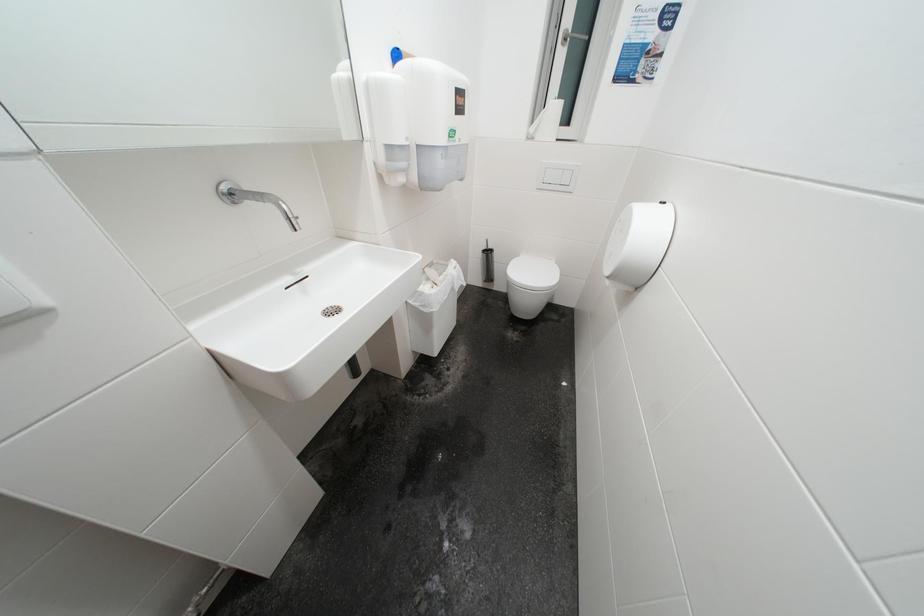
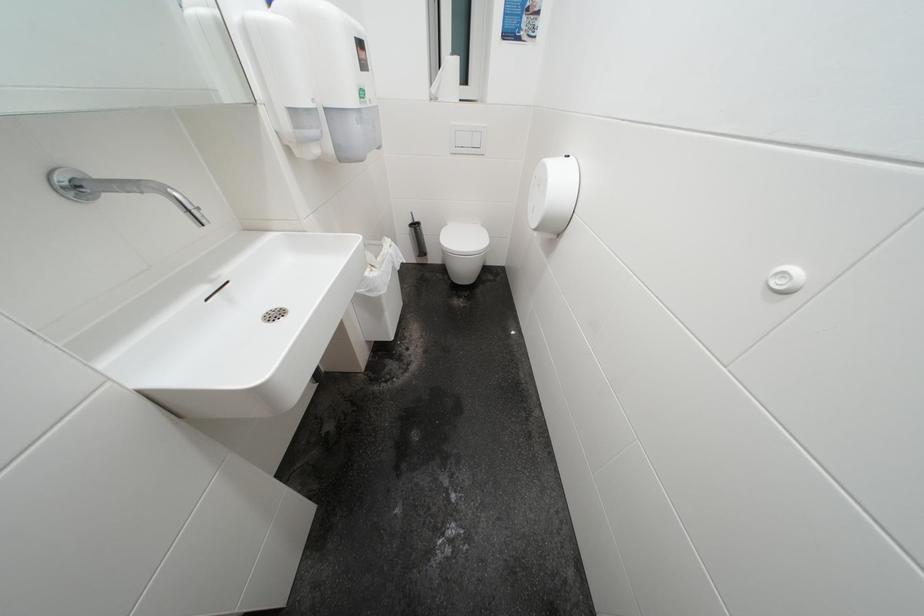
Question: The images are taken continuously from a first-person perspective. In which direction are you moving?

Choices:
 (A) Left
 (B) Right
 (C) Forward
 (D) Backward

Answer: (A)